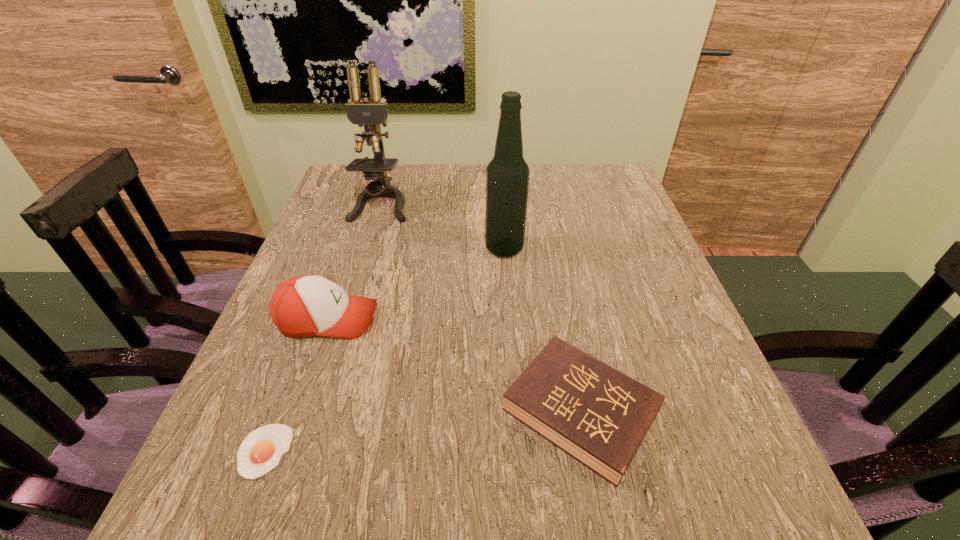
Identify the location of free location located on the right of the shortest object. Image resolution: width=960 pixels, height=540 pixels. (440, 451).

Locate an element on the screen. The image size is (960, 540). object at the far edge is located at coordinates (371, 114).

Locate an element on the screen. The width and height of the screenshot is (960, 540). hardback book that is at the near edge is located at coordinates (596, 414).

Where is `egg yolk situated at the near edge`? Image resolution: width=960 pixels, height=540 pixels. egg yolk situated at the near edge is located at coordinates (261, 450).

This screenshot has width=960, height=540. I want to click on microscope located in the left edge section of the desktop, so click(371, 114).

Identify the location of baseball cap that is at the left edge. The width and height of the screenshot is (960, 540). (303, 306).

Locate an element on the screen. This screenshot has height=540, width=960. egg yolk at the left edge is located at coordinates (261, 450).

Locate an element on the screen. Image resolution: width=960 pixels, height=540 pixels. object that is at the right edge is located at coordinates pos(596,414).

The image size is (960, 540). I want to click on object positioned at the far left corner, so click(x=371, y=114).

Locate an element on the screen. The height and width of the screenshot is (540, 960). object that is at the near left corner is located at coordinates (261, 450).